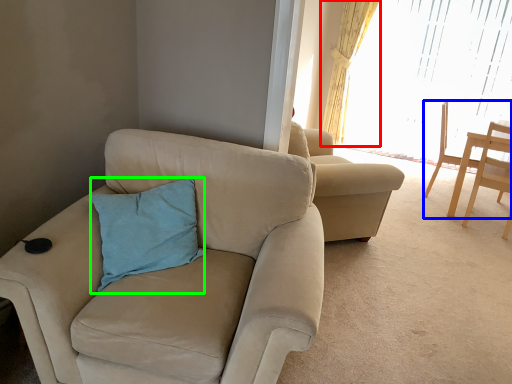
Question: Based on their relative distances, which object is farther from curtain (highlighted by a red box)? Choose from chair (highlighted by a blue box) and pillow (highlighted by a green box).

Choices:
 (A) chair
 (B) pillow

Answer: (B)